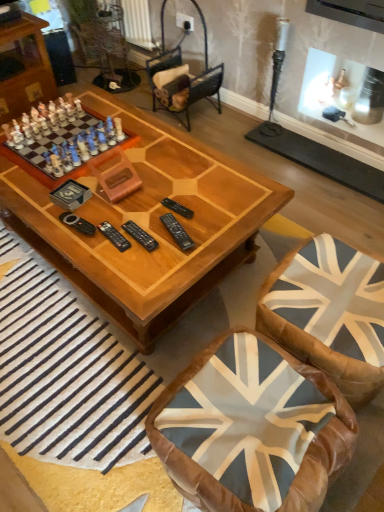
Question: Is porcelain chess set at left wider than velvet brown armchair at center?

Choices:
 (A) yes
 (B) no

Answer: (A)

Question: Does porcelain chess set at left appear on the right side of velvet brown armchair at center?

Choices:
 (A) yes
 (B) no

Answer: (B)

Question: Is porcelain chess set at left facing away from velvet brown armchair at center?

Choices:
 (A) no
 (B) yes

Answer: (A)

Question: Is porcelain chess set at left completely or partially outside of velvet brown armchair at center?

Choices:
 (A) yes
 (B) no

Answer: (A)

Question: Is porcelain chess set at left in front of velvet brown armchair at center?

Choices:
 (A) yes
 (B) no

Answer: (A)

Question: From the image's perspective, is black plastic remote at center above or below blue fabric swivel chair at lower right?

Choices:
 (A) above
 (B) below

Answer: (A)

Question: Is black plastic remote at center inside or outside of blue fabric swivel chair at lower right?

Choices:
 (A) outside
 (B) inside

Answer: (A)

Question: Visually, is black plastic remote at center positioned to the left or to the right of blue fabric swivel chair at lower right?

Choices:
 (A) left
 (B) right

Answer: (A)

Question: Considering the positions of point (145, 245) and point (322, 322), is point (145, 245) closer or farther from the camera than point (322, 322)?

Choices:
 (A) closer
 (B) farther

Answer: (B)

Question: Is point (238, 201) positioned closer to the camera than point (220, 67)?

Choices:
 (A) closer
 (B) farther

Answer: (A)

Question: Is wooden coffee table at center bigger or smaller than velvet brown armchair at center?

Choices:
 (A) big
 (B) small

Answer: (A)

Question: Is wooden coffee table at center spatially inside velvet brown armchair at center, or outside of it?

Choices:
 (A) outside
 (B) inside

Answer: (A)

Question: Is wooden coffee table at center to the left or to the right of velvet brown armchair at center in the image?

Choices:
 (A) left
 (B) right

Answer: (A)

Question: Is velvet brown armchair at center to the left or to the right of porcelain chess set at left in the image?

Choices:
 (A) right
 (B) left

Answer: (A)

Question: Which is correct: velvet brown armchair at center is inside porcelain chess set at left, or outside of it?

Choices:
 (A) inside
 (B) outside

Answer: (B)